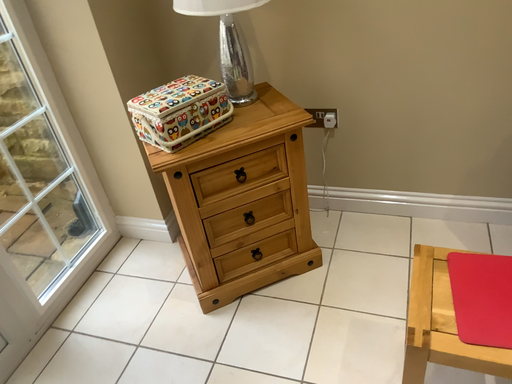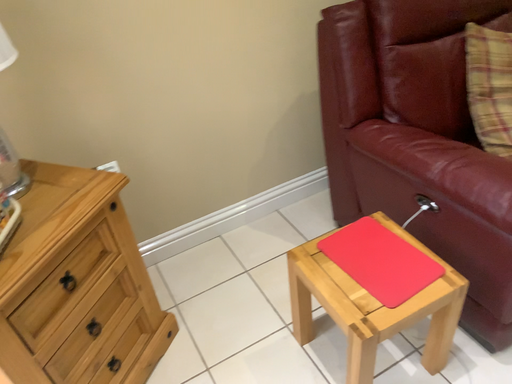
Question: How did the camera likely rotate when shooting the video?

Choices:
 (A) rotated right
 (B) rotated left

Answer: (A)